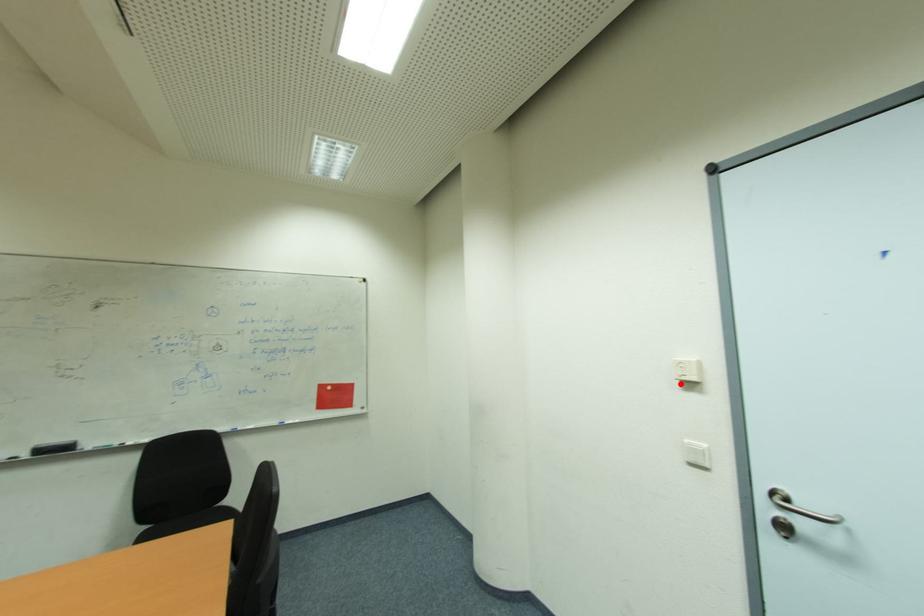
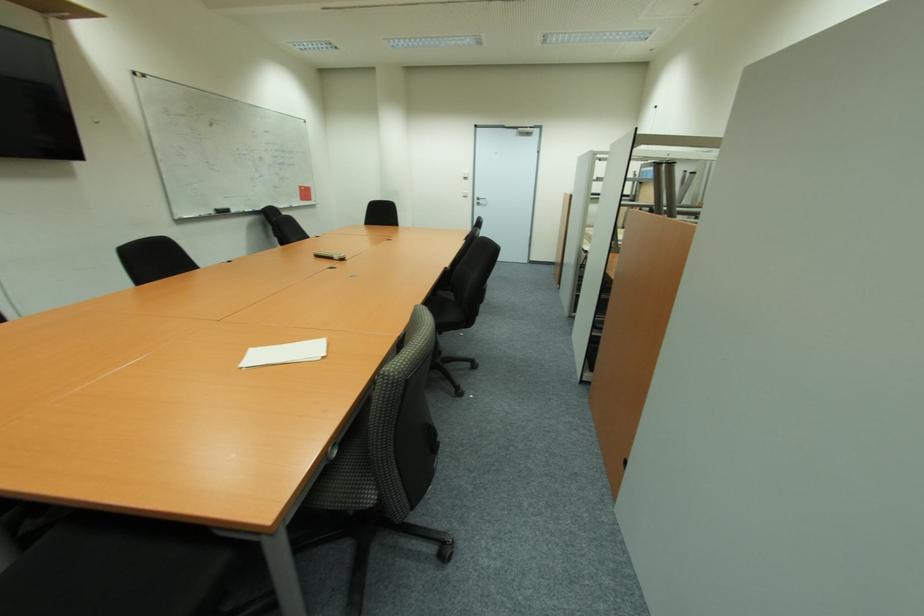
The point at the highlighted location is marked in the first image. Where is the corresponding point in the second image?

(467, 179)